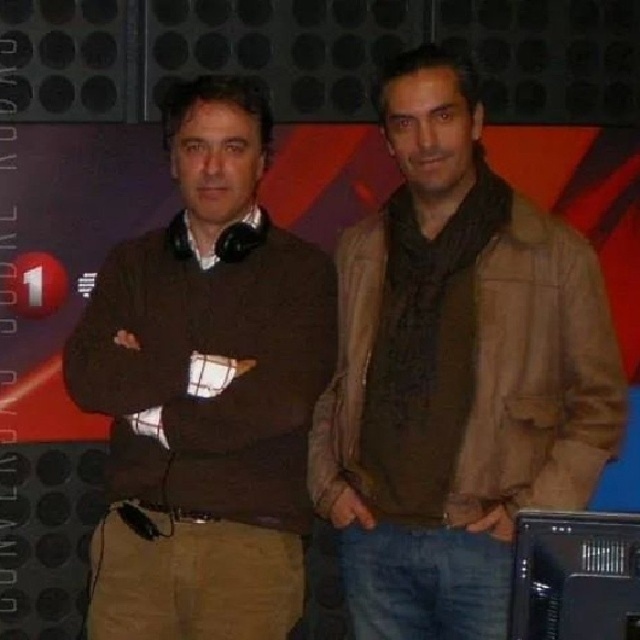
Question: Which object appears closest to the camera in this image?

Choices:
 (A) brown leather jacket at center
 (B) brown sweater at center

Answer: (A)

Question: Can you confirm if brown leather jacket at center is positioned to the left of brown sweater at center?

Choices:
 (A) no
 (B) yes

Answer: (A)

Question: Which of the following is the farthest from the observer?

Choices:
 (A) coord(387,134)
 (B) coord(77,323)

Answer: (B)

Question: Can you confirm if brown leather jacket at center is positioned below brown sweater at center?

Choices:
 (A) yes
 (B) no

Answer: (B)

Question: Does brown leather jacket at center appear on the left side of brown sweater at center?

Choices:
 (A) yes
 (B) no

Answer: (B)